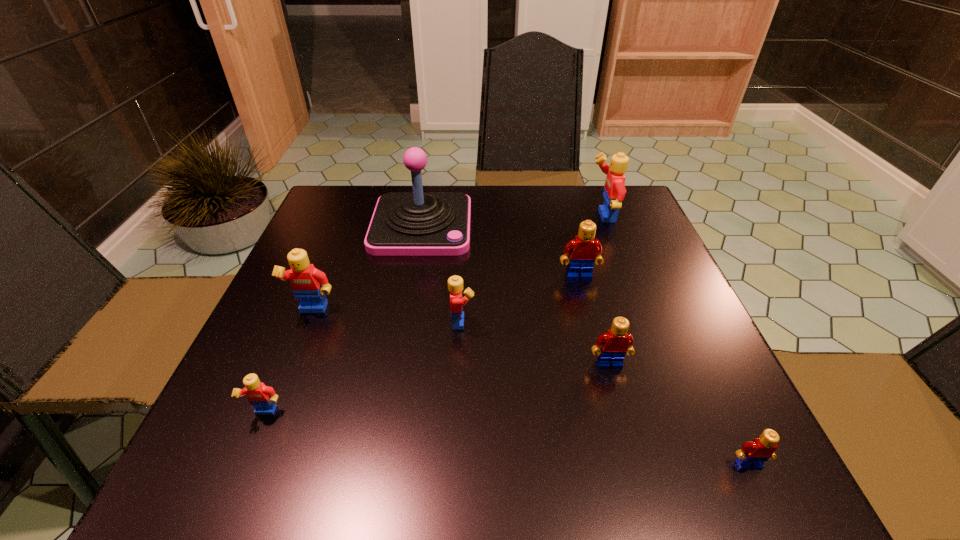
Where is `vacant point located between the third farthest object and the nearest object`? Image resolution: width=960 pixels, height=540 pixels. vacant point located between the third farthest object and the nearest object is located at coordinates (663, 371).

The image size is (960, 540). In order to click on unoccupied position between the third farthest object and the third smallest yellow Lego in this screenshot , I will do `click(446, 294)`.

This screenshot has width=960, height=540. Find the location of `vacant region between the smallest yellow Lego and the third smallest yellow Lego`. vacant region between the smallest yellow Lego and the third smallest yellow Lego is located at coordinates (290, 362).

Locate an element on the screen. vacant region between the pink joystick and the third smallest yellow Lego is located at coordinates (368, 269).

Identify the location of object that stands as the closest to the biggest yellow Lego. The image size is (960, 540). (584, 250).

Where is `object that is the third closest to the third smallest yellow Lego`? Image resolution: width=960 pixels, height=540 pixels. object that is the third closest to the third smallest yellow Lego is located at coordinates click(x=455, y=283).

Identify which Lego is the second nearest to the biggest red Lego. Please provide its 2D coordinates. Your answer should be formatted as a tuple, i.e. [(x, y)], where the tuple contains the x and y coordinates of a point satisfying the conditions above.

[(455, 283)]

The width and height of the screenshot is (960, 540). I want to click on Lego that is the fifth closest to the biggest yellow Lego, so click(x=308, y=284).

At what (x,y) coordinates should I click in order to perform the action: click on yellow Lego that is the closest to the rightmost red Lego. Please return your answer as a coordinate pair (x, y). This screenshot has width=960, height=540. Looking at the image, I should click on point(455,283).

The image size is (960, 540). Identify the location of yellow Lego that is the fourth closest to the pink joystick. (263, 398).